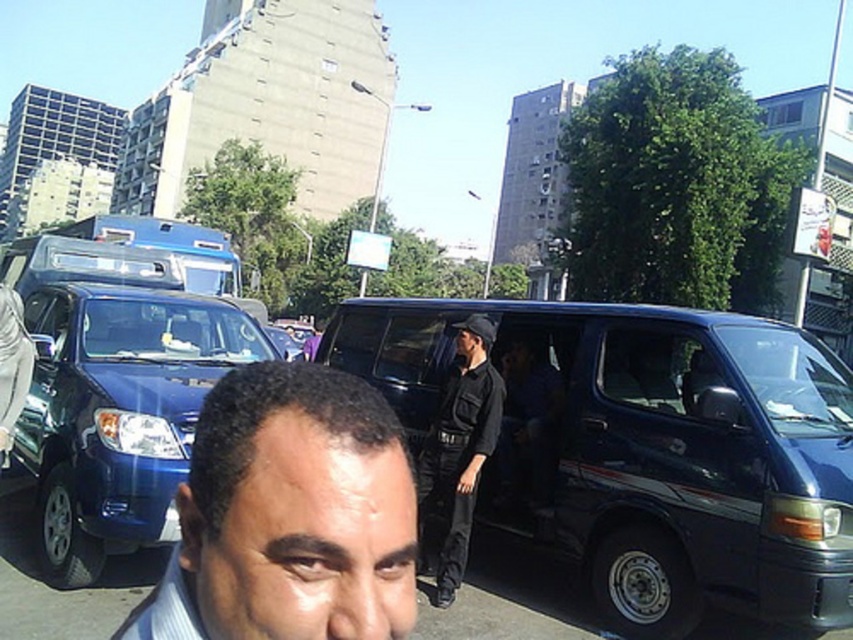
Who is taller, shiny dark blue van at center or smooth skin face at center?

With more height is shiny dark blue van at center.

This screenshot has width=853, height=640. Describe the element at coordinates (643, 449) in the screenshot. I see `shiny dark blue van at center` at that location.

Which is behind, point (595, 497) or point (339, 536)?

The point (595, 497) is behind.

What are the coordinates of `shiny dark blue van at center` in the screenshot? It's located at (643, 449).

Can you confirm if shiny dark blue van at center is positioned below black uniform at center?

Incorrect, shiny dark blue van at center is not positioned below black uniform at center.

You are a GUI agent. You are given a task and a screenshot of the screen. Output one action in this format:
    pyautogui.click(x=<x>, y=<y>)
    Task: Click on the shiny dark blue van at center
    The height and width of the screenshot is (640, 853).
    Given the screenshot: What is the action you would take?
    pyautogui.click(x=643, y=449)

Between point (711, 387) and point (473, 488), which one is positioned in front?

Point (711, 387)

This screenshot has height=640, width=853. Find the location of `shiny dark blue van at center`. shiny dark blue van at center is located at coordinates (643, 449).

Does smooth skin face at center appear on the left side of black uniform at center?

Indeed, smooth skin face at center is positioned on the left side of black uniform at center.

Is smooth skin face at center smaller than black uniform at center?

Correct, smooth skin face at center occupies less space than black uniform at center.

Which is behind, point (206, 458) or point (418, 516)?

The point (418, 516) is more distant.

Where is `smooth skin face at center`? smooth skin face at center is located at coordinates (289, 515).